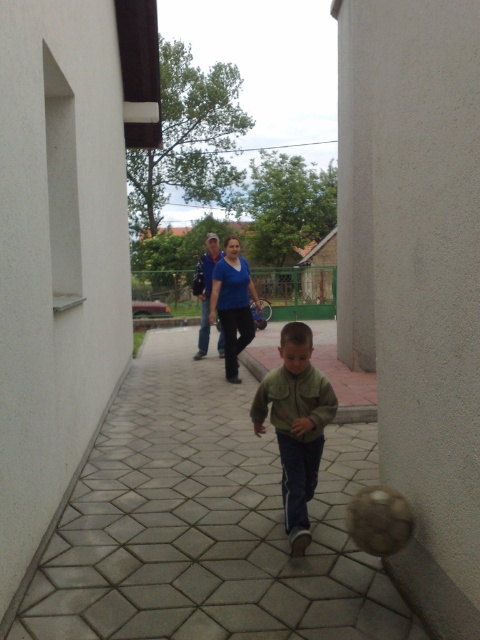
Does gray hexagonal tiles at center appear under green matte jacket at center?

Yes, gray hexagonal tiles at center is below green matte jacket at center.

Between gray hexagonal tiles at center and green matte jacket at center, which one appears on the right side from the viewer's perspective?

green matte jacket at center

Who is more distant from viewer, (404, 609) or (327, 422)?

The point (327, 422) is more distant.

Locate an element on the screen. gray hexagonal tiles at center is located at coordinates (204, 524).